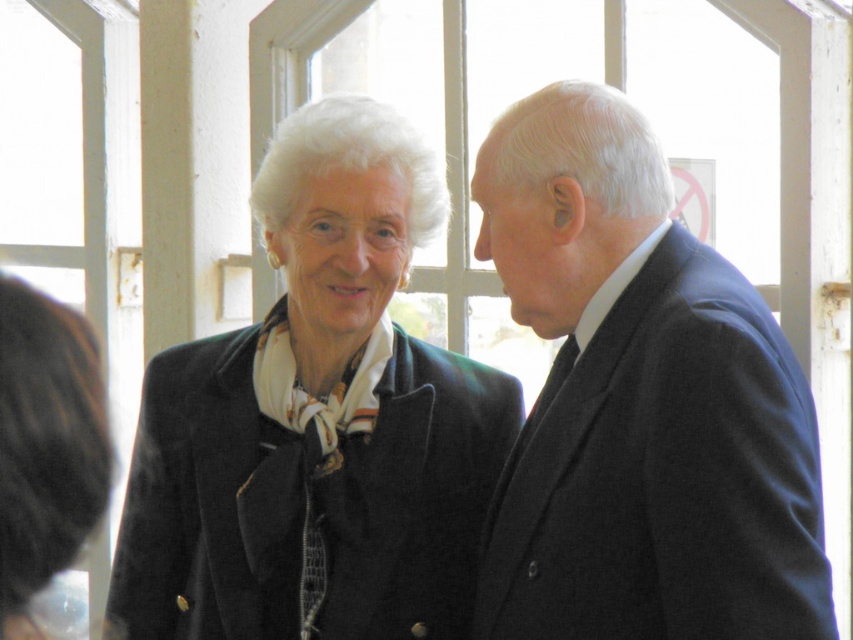
Question: In this image, where is dark blue suit at right located relative to matte black coat at center?

Choices:
 (A) left
 (B) right

Answer: (B)

Question: Among these points, which one is nearest to the camera?

Choices:
 (A) (252, 355)
 (B) (762, 592)

Answer: (B)

Question: Observing the image, what is the correct spatial positioning of dark blue suit at right in reference to matte black coat at center?

Choices:
 (A) left
 (B) right

Answer: (B)

Question: Which point is closer to the camera?

Choices:
 (A) (450, 442)
 (B) (821, 621)

Answer: (B)

Question: Considering the relative positions of dark blue suit at right and matte black coat at center in the image provided, where is dark blue suit at right located with respect to matte black coat at center?

Choices:
 (A) right
 (B) left

Answer: (A)

Question: Which point is farther to the camera?

Choices:
 (A) dark blue suit at right
 (B) matte black coat at center

Answer: (B)